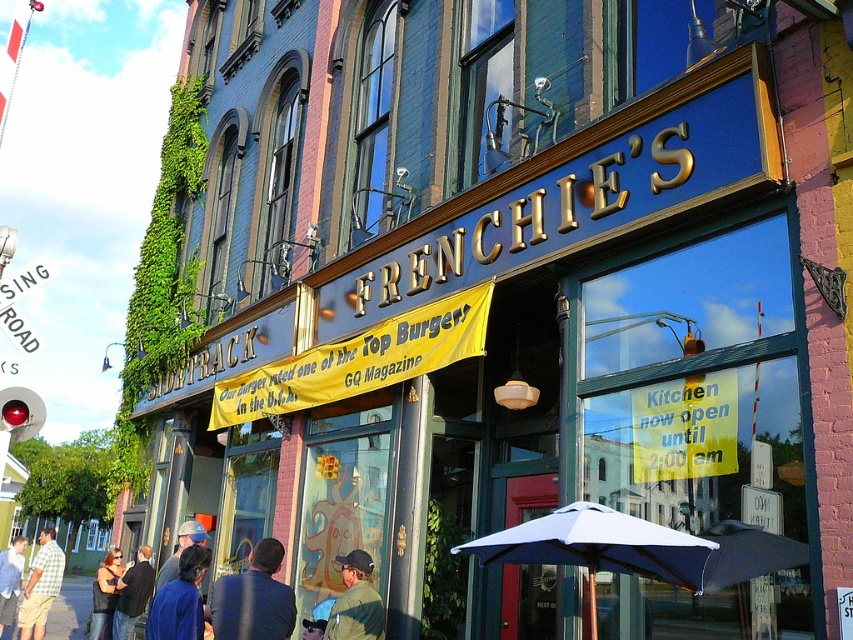
Question: Which of the following is the closest to the observer?

Choices:
 (A) (337, 563)
 (B) (105, 614)
 (C) (166, 625)
 (D) (49, 531)

Answer: (C)

Question: Which of the following is the farthest from the observer?

Choices:
 (A) dark blue jacket at lower left
 (B) denim jacket at lower left

Answer: (B)

Question: Which point is closer to the camera taking this photo?

Choices:
 (A) (22, 536)
 (B) (770, 561)
 (C) (350, 609)

Answer: (B)

Question: Observing the image, what is the correct spatial positioning of dark blue fabric umbrella at center in reference to dark blue shirt at lower left?

Choices:
 (A) left
 (B) right

Answer: (B)

Question: Can you confirm if green fabric jacket at lower center is positioned above light blue shirt at lower left?

Choices:
 (A) yes
 (B) no

Answer: (A)

Question: Can you confirm if dark blue denim jacket at lower left is bigger than dark blue jacket at lower left?

Choices:
 (A) no
 (B) yes

Answer: (B)